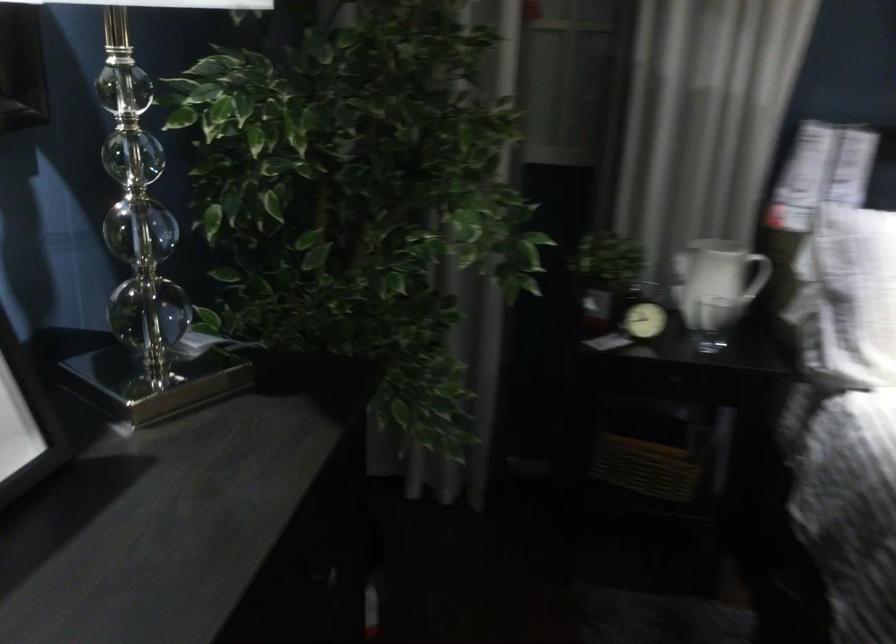
Find the location of a particular element. The image size is (896, 644). wicker basket is located at coordinates (645, 467).